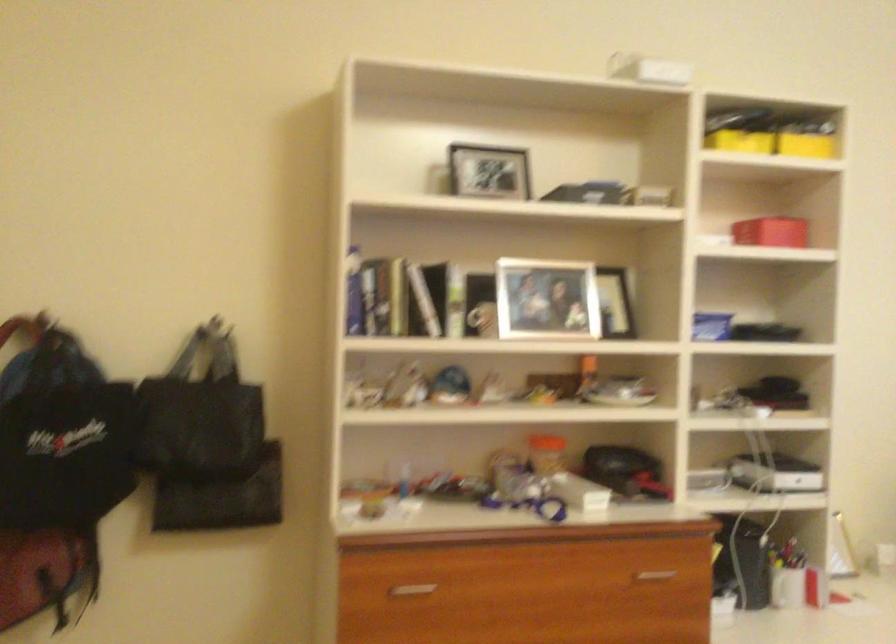
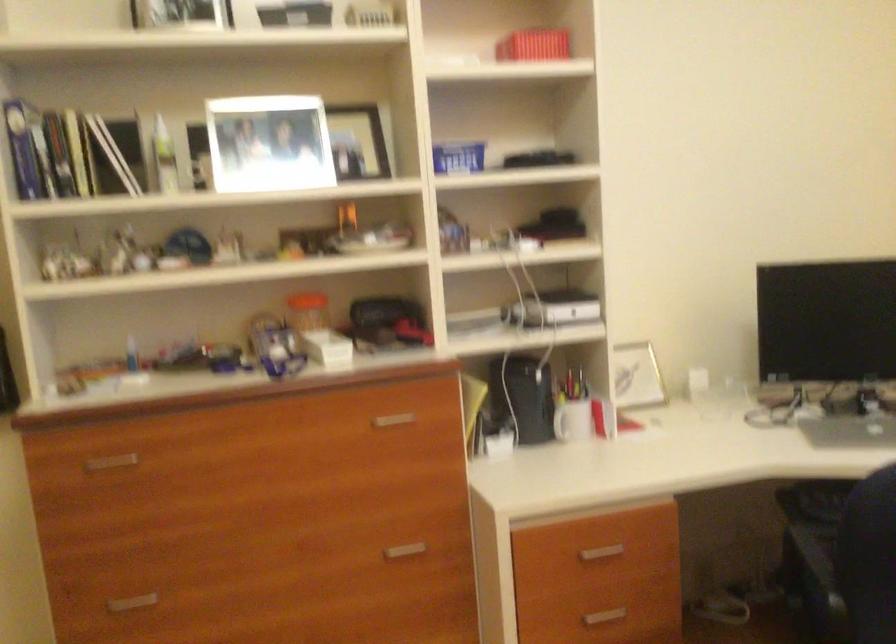
Where in the second image is the point corresponding to pixel 647 571 from the first image?

(392, 420)